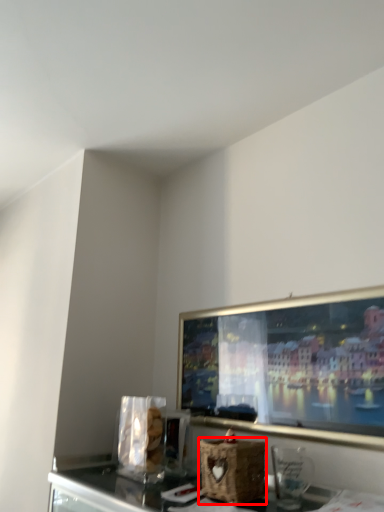
Question: In this image, where is basket (annotated by the red box) located relative to appliance?

Choices:
 (A) right
 (B) left

Answer: (B)